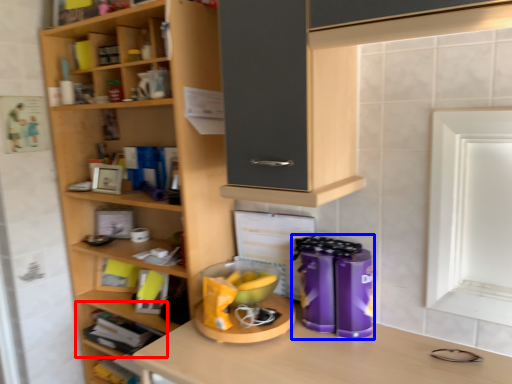
Question: Which object is further to the camera taking this photo, shelf (highlighted by a red box) or appliance (highlighted by a blue box)?

Choices:
 (A) shelf
 (B) appliance

Answer: (A)